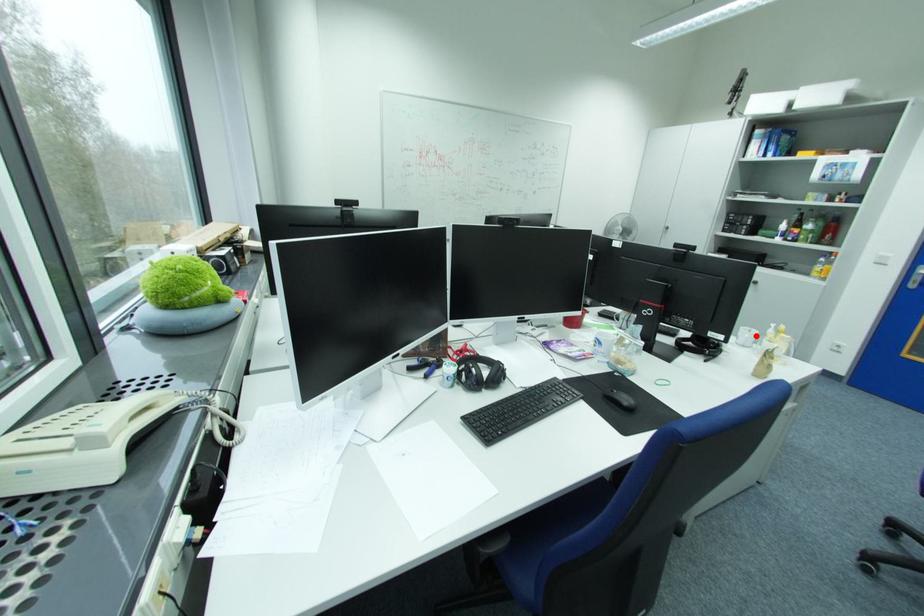
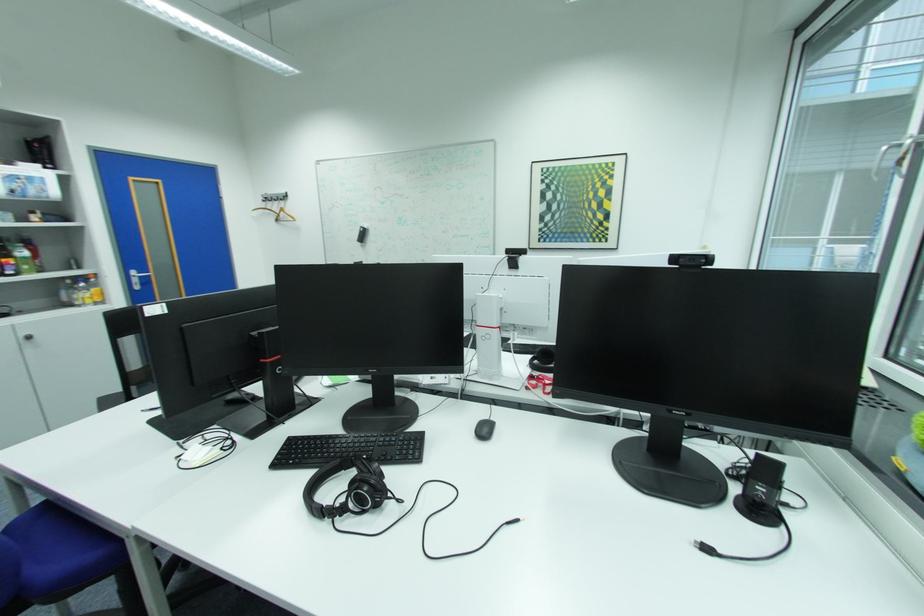
Question: I am providing you with two images of the same scene from different viewpoints. A red point is marked on the first image. Is the red point's position out of view in image 2?

Choices:
 (A) Yes
 (B) No

Answer: (A)